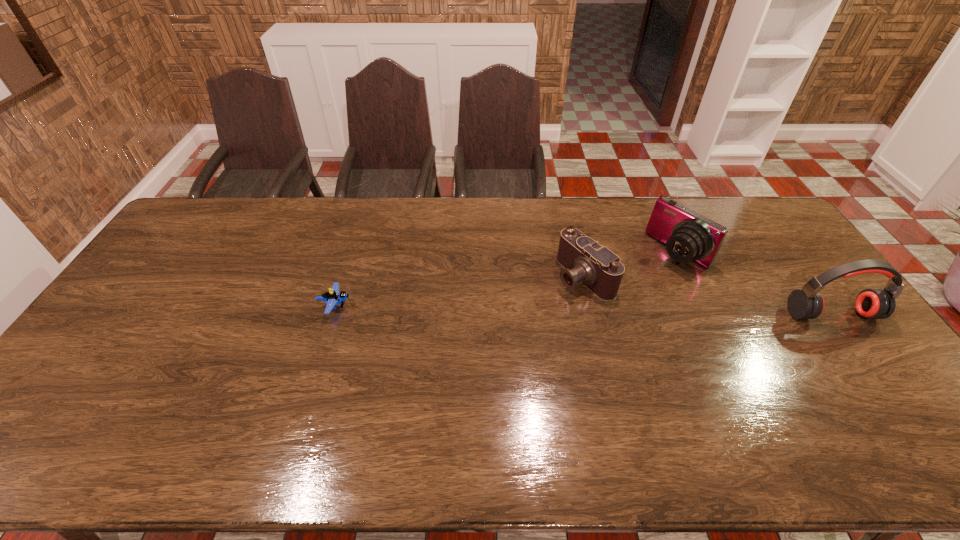
The width and height of the screenshot is (960, 540). In order to click on free space located on the front-facing side of the second object from right to left in this screenshot , I will do `click(588, 325)`.

The width and height of the screenshot is (960, 540). Identify the location of vacant space situated 0.280m on the front-facing side of the second object from right to left. (609, 310).

You are a GUI agent. You are given a task and a screenshot of the screen. Output one action in this format:
    pyautogui.click(x=<x>, y=<y>)
    Task: Click on the free space located on the front-facing side of the second object from right to left
    This screenshot has height=540, width=960.
    Given the screenshot: What is the action you would take?
    pyautogui.click(x=626, y=297)

Locate an element on the screen. This screenshot has height=540, width=960. free location located on the front-facing side of the left camera is located at coordinates (516, 313).

I want to click on vacant space located on the front-facing side of the left camera, so click(x=550, y=295).

At what (x,y) coordinates should I click in order to perform the action: click on free region located 0.200m on the front-facing side of the left camera. Please return your answer as a coordinate pair (x, y). Image resolution: width=960 pixels, height=540 pixels. Looking at the image, I should click on (510, 316).

The height and width of the screenshot is (540, 960). What are the coordinates of `object that is at the far edge` in the screenshot? It's located at (688, 236).

The image size is (960, 540). I want to click on object located at the right edge, so click(807, 303).

In the image, there is a desktop. Identify the location of vacant space at the far edge. The width and height of the screenshot is (960, 540). (477, 236).

Image resolution: width=960 pixels, height=540 pixels. Identify the location of vacant space at the near edge of the desktop. (258, 401).